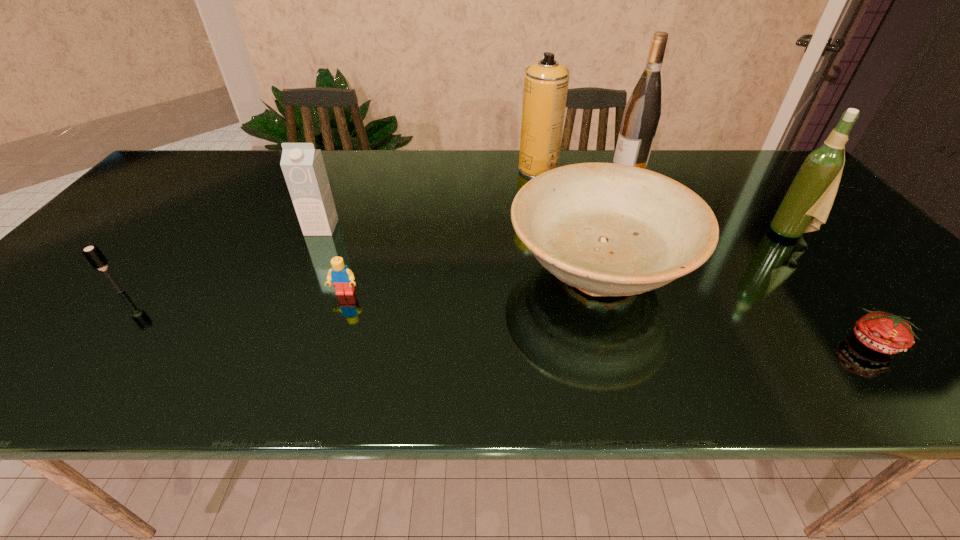
Find the location of a particular element. blank area located 0.180m on the right of the third shortest object is located at coordinates (207, 291).

Identify the location of vacant area situated on the front-facing side of the second shortest object. This screenshot has width=960, height=540. (328, 346).

This screenshot has height=540, width=960. What are the coordinates of `vacant space located 0.300m on the back of the shortest object` in the screenshot? It's located at (787, 237).

The image size is (960, 540). Identify the location of wine bottle located at the far edge. (641, 116).

What are the coordinates of `aerosol can that is at the far edge` in the screenshot? It's located at (546, 82).

Find the location of a particular element. object positioned at the near edge is located at coordinates pyautogui.click(x=886, y=333).

The width and height of the screenshot is (960, 540). I want to click on object that is at the left edge, so click(93, 254).

Locate an element on the screen. wine bottle present at the right edge is located at coordinates (806, 205).

Identify the location of tomato positioned at the right edge. The height and width of the screenshot is (540, 960). (886, 333).

Locate an element on the screen. object located in the near right corner section of the desktop is located at coordinates (886, 333).